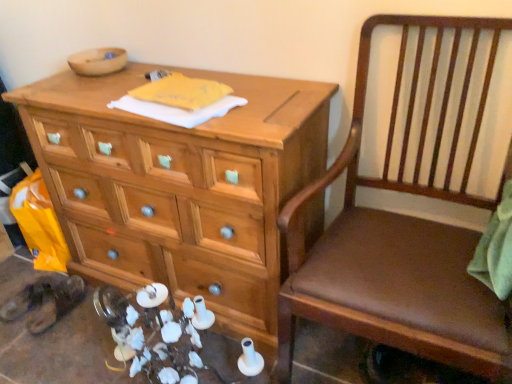
Question: From the image's perspective, is natural wood chest of drawers at center above or below brown wood chair at right?

Choices:
 (A) below
 (B) above

Answer: (B)

Question: Considering their positions, is natural wood chest of drawers at center located in front of or behind brown wood chair at right?

Choices:
 (A) front
 (B) behind

Answer: (B)

Question: Is natural wood chest of drawers at center taller or shorter than brown wood chair at right?

Choices:
 (A) tall
 (B) short

Answer: (B)

Question: In terms of height, does brown wood chair at right look taller or shorter compared to natural wood chest of drawers at center?

Choices:
 (A) short
 (B) tall

Answer: (B)

Question: In the image, is brown wood chair at right positioned in front of or behind natural wood chest of drawers at center?

Choices:
 (A) front
 (B) behind

Answer: (A)

Question: From the image's perspective, is brown wood chair at right above or below natural wood chest of drawers at center?

Choices:
 (A) below
 (B) above

Answer: (A)

Question: Considering the positions of point (485, 354) and point (34, 117), is point (485, 354) closer or farther from the camera than point (34, 117)?

Choices:
 (A) closer
 (B) farther

Answer: (A)